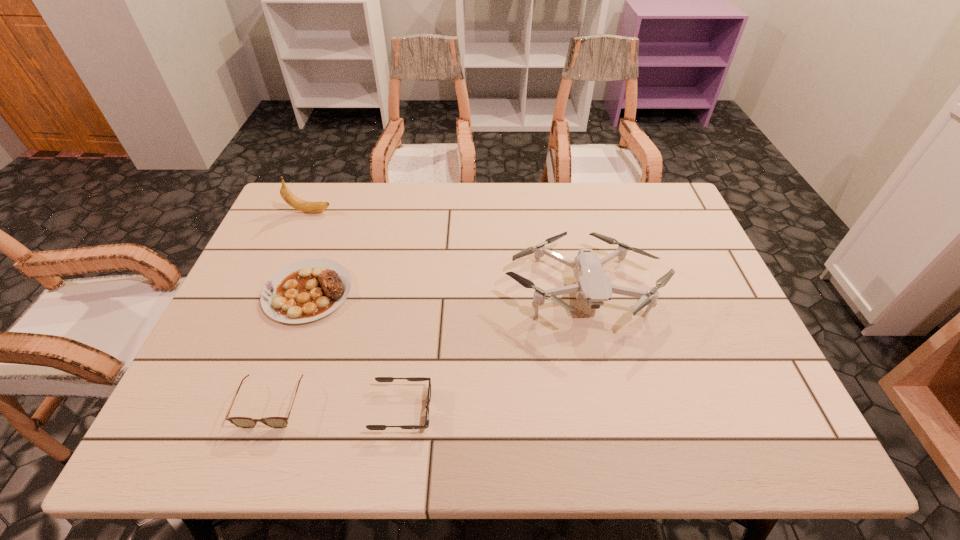
Locate an element on the screen. vacant space situated 0.190m on the front of the steak is located at coordinates (270, 396).

The image size is (960, 540). In order to click on vacant space situated on the temples of the shortest object in this screenshot , I will do `click(469, 409)`.

I want to click on object that is at the far edge, so click(x=306, y=206).

The width and height of the screenshot is (960, 540). Identify the location of spectacles located at the near edge. (243, 422).

Locate an element on the screen. This screenshot has height=540, width=960. sunglasses that is at the near edge is located at coordinates (379, 379).

Image resolution: width=960 pixels, height=540 pixels. I want to click on banana positioned at the left edge, so click(x=306, y=206).

This screenshot has width=960, height=540. What are the coordinates of `steak that is at the left edge` in the screenshot? It's located at (307, 290).

The image size is (960, 540). Identify the location of spectacles positioned at the left edge. point(243,422).

This screenshot has width=960, height=540. What are the coordinates of `object at the right edge` in the screenshot? It's located at (593, 285).

Identify the location of object that is at the far left corner. (306, 206).